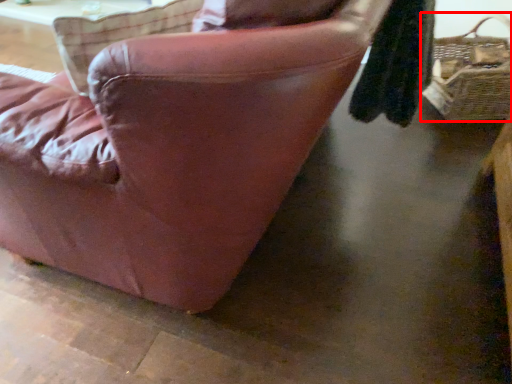
Question: In this image, where is picnic basket (annotated by the red box) located relative to chair?

Choices:
 (A) right
 (B) left

Answer: (A)